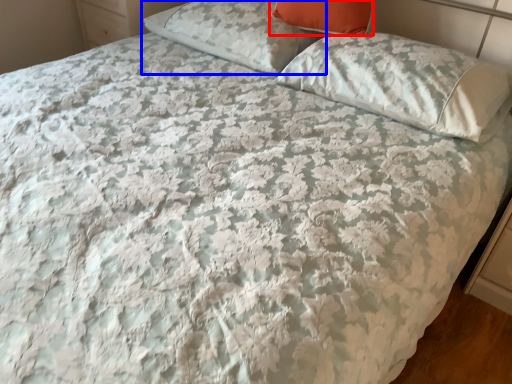
Question: Which of the following is the closest to the observer, pillow (highlighted by a red box) or pillow (highlighted by a blue box)?

Choices:
 (A) pillow
 (B) pillow

Answer: (A)